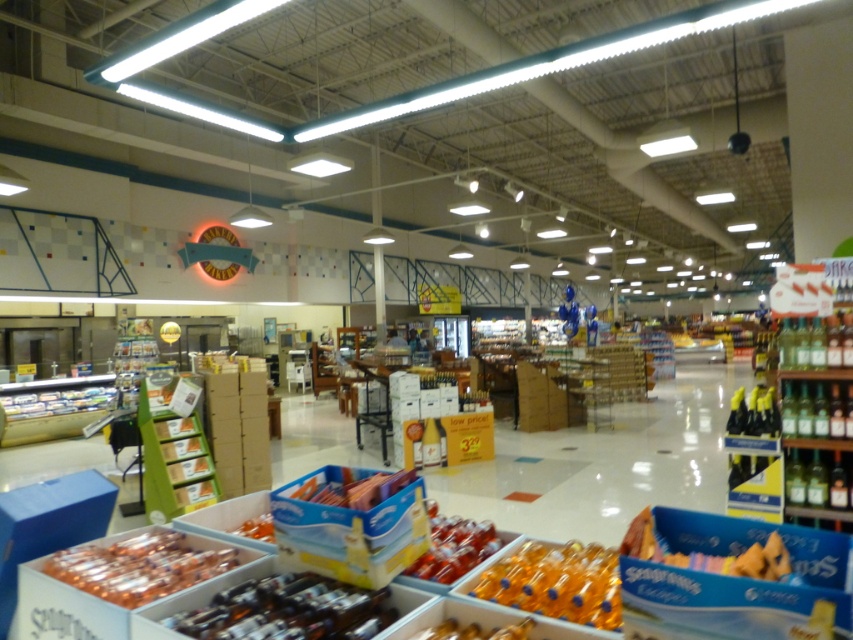
Question: Which point is closer to the camera?

Choices:
 (A) translucent orange bottle at lower center
 (B) blue cardboard box at center
 (C) translucent plastic bottles at lower left
 (D) smooth plastic candy at center

Answer: (A)

Question: Does translucent orange bottle at lower center appear over smooth plastic candy at center?

Choices:
 (A) no
 (B) yes

Answer: (A)

Question: Which of the following is the closest to the observer?

Choices:
 (A) blue cardboard box at center
 (B) translucent plastic bottles at center

Answer: (B)

Question: Does translucent orange bottle at lower center have a lesser width compared to smooth plastic candy at center?

Choices:
 (A) no
 (B) yes

Answer: (A)

Question: Which object appears closest to the camera in this image?

Choices:
 (A) translucent plastic bottles at lower left
 (B) translucent plastic bag at center

Answer: (A)

Question: Can you confirm if translucent plastic bottles at lower left is positioned below translucent plastic bag at center?

Choices:
 (A) yes
 (B) no

Answer: (A)